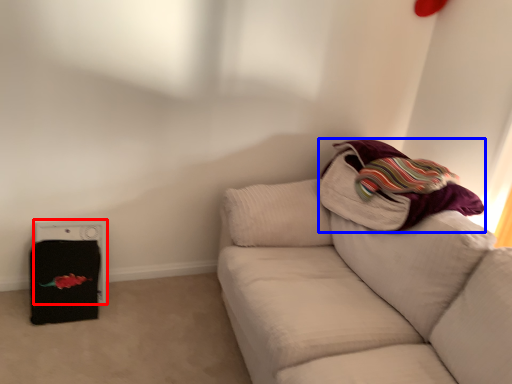
Question: Which point is further to the camera, appliance (highlighted by a red box) or blanket (highlighted by a blue box)?

Choices:
 (A) appliance
 (B) blanket

Answer: (A)